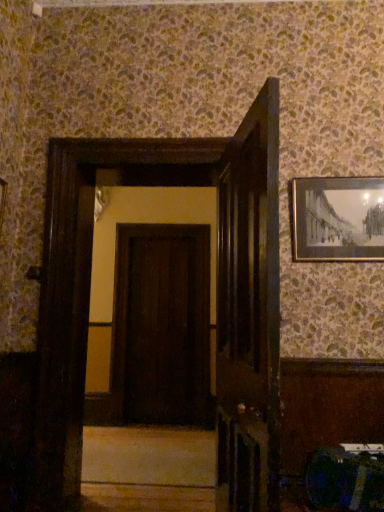
I want to click on free space above gold-framed picture at upper right (from a real-world perspective), so click(350, 173).